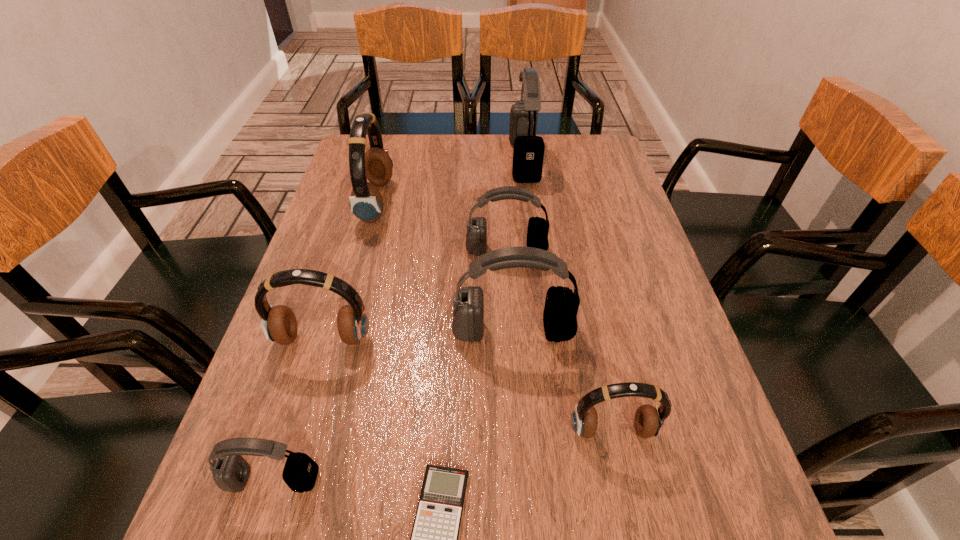
The width and height of the screenshot is (960, 540). Find the location of `the biggest black headset`. the biggest black headset is located at coordinates (528, 152).

This screenshot has height=540, width=960. I want to click on the farthest brown headset, so click(x=366, y=203).

Locate an element on the screen. the third farthest black headset is located at coordinates (561, 306).

Where is `the second biggest brown headset`? The width and height of the screenshot is (960, 540). the second biggest brown headset is located at coordinates (279, 324).

Find the location of a particular element. Image resolution: width=960 pixels, height=540 pixels. the second smallest black headset is located at coordinates (538, 228).

Locate an element on the screen. The width and height of the screenshot is (960, 540). the third farthest object is located at coordinates [x=538, y=228].

Image resolution: width=960 pixels, height=540 pixels. In order to click on the rightmost brown headset in this screenshot , I will do `click(649, 421)`.

You are a GUI agent. You are given a task and a screenshot of the screen. Output one action in this format:
    pyautogui.click(x=<x>, y=<y>)
    Task: Click on the nearest brown headset
    The image size is (960, 540).
    Given the screenshot: What is the action you would take?
    pyautogui.click(x=649, y=421)

The image size is (960, 540). I want to click on the nearest black headset, so click(231, 471).

Identify the location of the nearest headset. The image size is (960, 540). (231, 471).